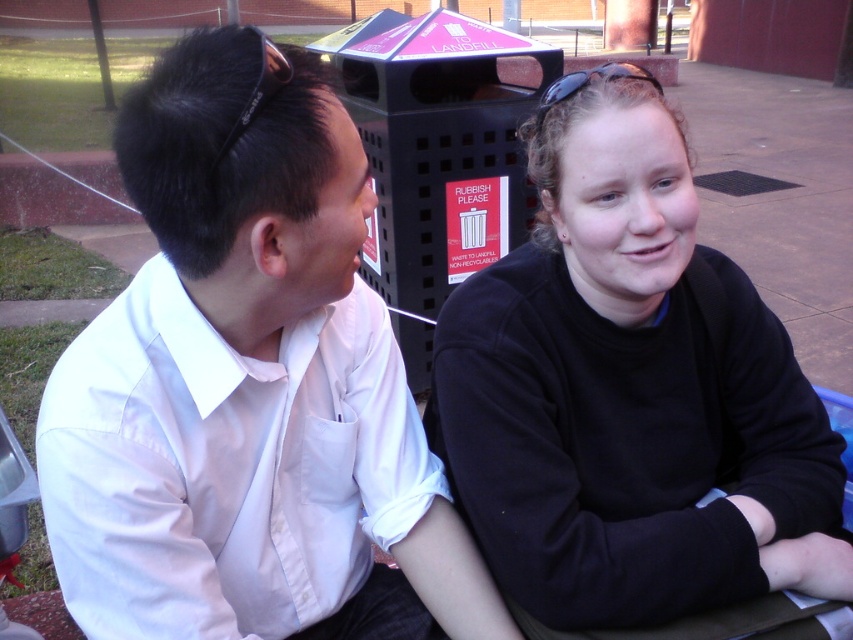
Question: Does black matte sweater at center have a greater width compared to white smooth shirt at left?

Choices:
 (A) yes
 (B) no

Answer: (A)

Question: Does black matte sweater at center appear on the right side of white smooth shirt at left?

Choices:
 (A) no
 (B) yes

Answer: (B)

Question: Which object appears farthest from the camera in this image?

Choices:
 (A) white smooth shirt at left
 (B) black matte sweater at center

Answer: (B)

Question: Does black matte sweater at center appear over white smooth shirt at left?

Choices:
 (A) yes
 (B) no

Answer: (A)